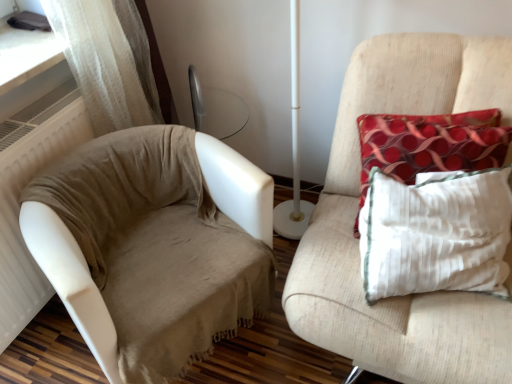
The image size is (512, 384). Describe the element at coordinates (430, 144) in the screenshot. I see `red dotted fabric pillow at right` at that location.

You are a GUI agent. You are given a task and a screenshot of the screen. Output one action in this format:
    pyautogui.click(x=<x>, y=<y>)
    Task: Click on the beige fabric couch at left
    This screenshot has width=512, height=384.
    Given the screenshot: What is the action you would take?
    coord(156,247)

How different are the orientations of textured beige armchair at right and red dotted fabric pillow at right in degrees?

The facing directions of textured beige armchair at right and red dotted fabric pillow at right are 0.904 degrees apart.

Which of these two, textured beige armchair at right or red dotted fabric pillow at right, is smaller?

With smaller size is red dotted fabric pillow at right.

From a real-world perspective, which object stands above the other?

red dotted fabric pillow at right.

Are red dotted fabric pillow at right and textured beige armchair at right located far from each other?

No, red dotted fabric pillow at right is not far from textured beige armchair at right.

Is red dotted fabric pillow at right facing away from textured beige armchair at right?

Correct, red dotted fabric pillow at right is looking away from textured beige armchair at right.

Considering the positions of objects red dotted fabric pillow at right and textured beige armchair at right in the image provided, who is behind, red dotted fabric pillow at right or textured beige armchair at right?

red dotted fabric pillow at right.

Is red dotted fabric pillow at right smaller than textured beige armchair at right?

Yes.

Is red dotted fabric pillow at right turned away from beige fabric couch at left?

No, red dotted fabric pillow at right's orientation is not away from beige fabric couch at left.

At what (x,y) coordinates should I click in order to perform the action: click on studio couch below the red dotted fabric pillow at right (from a real-world perspective). Please return your answer as a coordinate pair (x, y). The image size is (512, 384). Looking at the image, I should click on (156, 247).

From a real-world perspective, which is physically above, red dotted fabric pillow at right or beige fabric couch at left?

red dotted fabric pillow at right, from a real-world perspective.

Is beige fabric couch at left at the left side of red dotted fabric pillow at right?

Correct, you'll find beige fabric couch at left to the left of red dotted fabric pillow at right.

Consider the image. Considering the relative sizes of beige fabric couch at left and red dotted fabric pillow at right in the image provided, is beige fabric couch at left taller than red dotted fabric pillow at right?

Correct, beige fabric couch at left is much taller as red dotted fabric pillow at right.

Is beige fabric couch at left closer to camera compared to red dotted fabric pillow at right?

Yes, the depth of beige fabric couch at left is less than that of red dotted fabric pillow at right.

In the scene shown: How many degrees apart are the facing directions of beige fabric couch at left and red dotted fabric pillow at right?

63.2 degrees.

Consider the image. Relative to beige fabric couch at left, is textured beige armchair at right in front or behind?

textured beige armchair at right is positioned closer to the viewer than beige fabric couch at left.

You are a GUI agent. You are given a task and a screenshot of the screen. Output one action in this format:
    pyautogui.click(x=<x>, y=<y>)
    Task: Click on the furniture on the right of the beige fabric couch at left
    The height and width of the screenshot is (384, 512).
    Given the screenshot: What is the action you would take?
    pyautogui.click(x=356, y=210)

Is textured beige armchair at right facing towards beige fabric couch at left?

Answer: No, textured beige armchair at right is not aimed at beige fabric couch at left.

From a real-world perspective, is textured beige armchair at right located beneath beige fabric couch at left?

Actually, textured beige armchair at right is physically above beige fabric couch at left in the real world.

Is beige fabric couch at left next to textured beige armchair at right and touching it?

No, beige fabric couch at left is not touching textured beige armchair at right.

Can you confirm if beige fabric couch at left is thinner than textured beige armchair at right?

Yes.

Can we say beige fabric couch at left lies outside textured beige armchair at right?

That's correct, beige fabric couch at left is outside of textured beige armchair at right.

Between beige fabric couch at left and textured beige armchair at right, which one has less height?

With less height is beige fabric couch at left.

Where is `furniture below the red dotted fabric pillow at right (from a real-world perspective)`? furniture below the red dotted fabric pillow at right (from a real-world perspective) is located at coordinates (356, 210).

Image resolution: width=512 pixels, height=384 pixels. I want to click on pillow to the left of textured beige armchair at right, so click(430, 144).

Looking at the image, which one is located further to red dotted fabric pillow at right, beige fabric couch at left or textured beige armchair at right?

The object further to red dotted fabric pillow at right is beige fabric couch at left.

Looking at the image, which one is located closer to red dotted fabric pillow at right, textured beige armchair at right or beige fabric couch at left?

Among the two, textured beige armchair at right is located nearer to red dotted fabric pillow at right.

Based on their spatial positions, is beige fabric couch at left or red dotted fabric pillow at right further from textured beige armchair at right?

Based on the image, beige fabric couch at left appears to be further to textured beige armchair at right.

Considering their positions, is textured beige armchair at right positioned further to beige fabric couch at left than red dotted fabric pillow at right?

Among the two, red dotted fabric pillow at right is located further to beige fabric couch at left.

Looking at the image, which one is located closer to beige fabric couch at left, red dotted fabric pillow at right or textured beige armchair at right?

textured beige armchair at right is positioned closer to the anchor beige fabric couch at left.

Looking at this image, considering their positions, is red dotted fabric pillow at right positioned closer to textured beige armchair at right than beige fabric couch at left?

Based on the image, red dotted fabric pillow at right appears to be nearer to textured beige armchair at right.

Where is `pillow between beige fabric couch at left and textured beige armchair at right in the horizontal direction`? pillow between beige fabric couch at left and textured beige armchair at right in the horizontal direction is located at coordinates [430, 144].